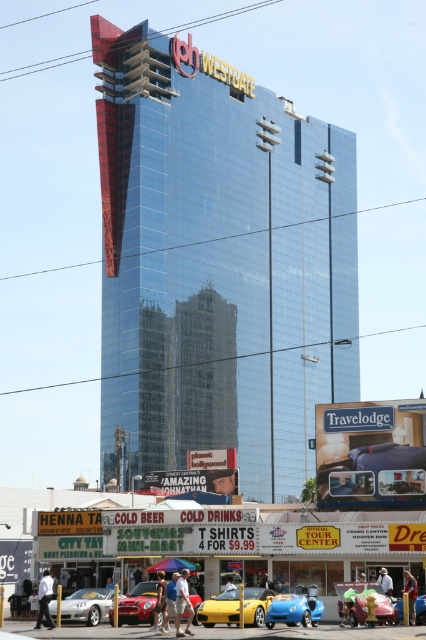
You are a pedestrian standing on the sidewalk in front of the Westgate building. You see a silver metallic sports car at center and a denim jacket at center. Which object is closer to the left side of the street?

The silver metallic sports car at center is positioned on the left side of the denim jacket at center, so it is closer to the left side of the street.

You are a photographer standing in front of the Westgate building. You notice a person wearing a white shirt at center and light blue jeans at lower center. Which piece of clothing appears larger in the image?

The white shirt at center appears larger than the light blue jeans at lower center.